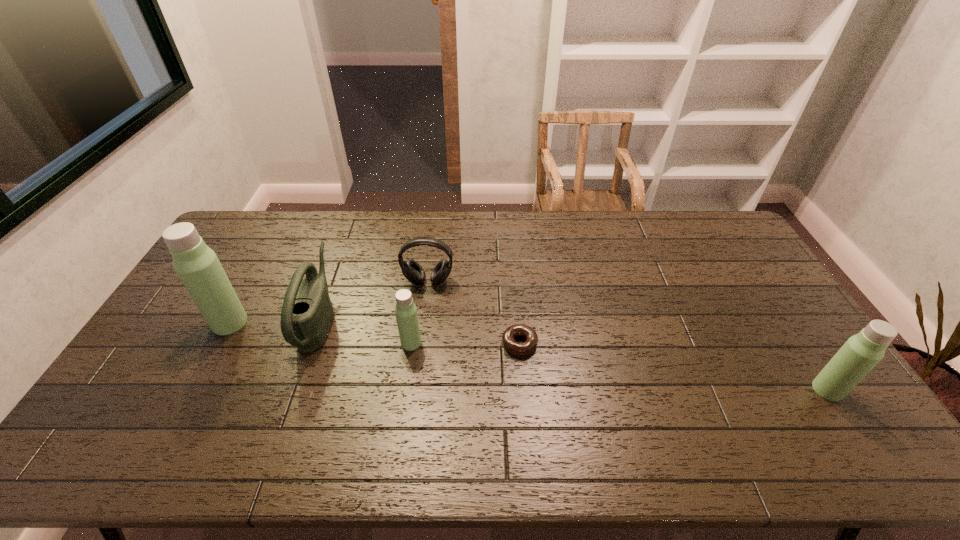
This screenshot has width=960, height=540. What are the coordinates of `the tallest thermos bottle` in the screenshot? It's located at (198, 267).

This screenshot has height=540, width=960. What are the coordinates of `the leftmost object` in the screenshot? It's located at (198, 267).

You are a GUI agent. You are given a task and a screenshot of the screen. Output one action in this format:
    pyautogui.click(x=<x>, y=<y>)
    Task: Click on the second thermos bottle from left to right
    This screenshot has height=540, width=960.
    Given the screenshot: What is the action you would take?
    pyautogui.click(x=406, y=314)

Locate an element on the screen. the rightmost object is located at coordinates (862, 352).

Find the location of a particular element. The height and width of the screenshot is (540, 960). the nearest object is located at coordinates (862, 352).

Where is `headset`? The height and width of the screenshot is (540, 960). headset is located at coordinates (413, 272).

The width and height of the screenshot is (960, 540). Identify the location of the shortest object. (511, 345).

Where is `doughnut`? doughnut is located at coordinates (511, 345).

The image size is (960, 540). I want to click on the second object from left to right, so click(x=307, y=312).

Image resolution: width=960 pixels, height=540 pixels. I want to click on vacant area situated on the front of the tallest thermos bottle, so click(213, 352).